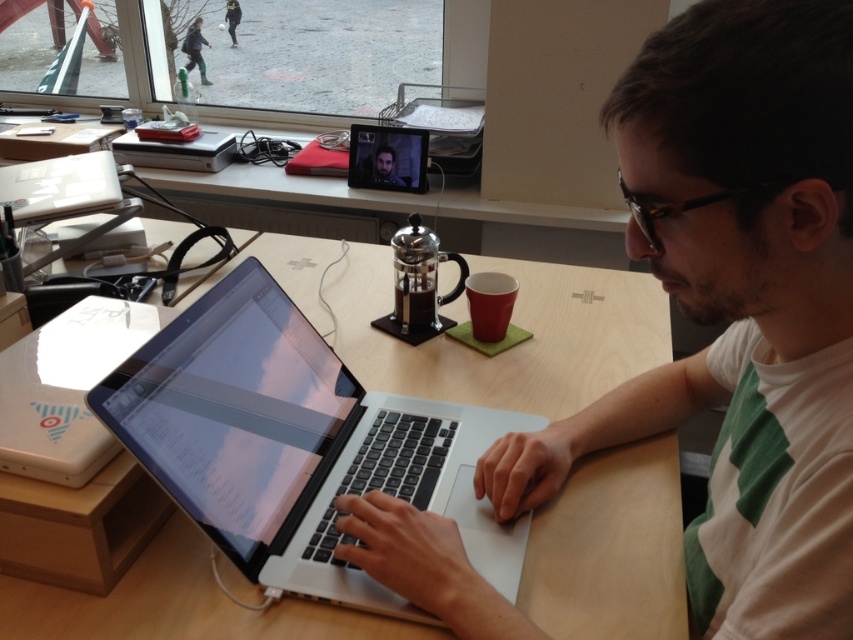
You are a personal assistant standing next to the desk. The user is wearing a white cotton shirt at center and needs to reach a pen that is 50 centimeters away from them. Can they comfortably reach it while sitting?

The white cotton shirt at center and viewer are 48.71 centimeters apart. Since the pen is 50 centimeters away from the user, which is slightly farther than the distance between them and the viewer, the user may need to stretch slightly to reach it but it should still be within a comfortable reach.

You are a photographer taking a portrait of the person at the desk. The white cotton shirt at center and the sleek silver laptop at center are both in the frame. Which object is taller in the photo?

The white cotton shirt at center is much taller than the sleek silver laptop at center in the photo.

You are a photographer trying to capture a closeup of the laptop screen. You notice two points in the image at coordinates point (x=202, y=328) and point (x=90, y=372). Which point should you focus on to ensure the closest object is in focus?

Point (x=202, y=328) is closer to the camera than point (x=90, y=372), so focusing on it will ensure the closest object is in focus.